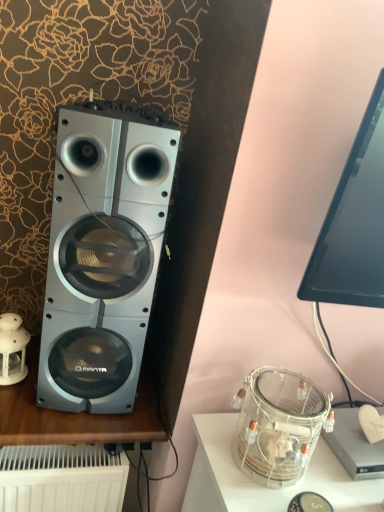
Question: Could you tell me if clear glass jar at lower right is turned towards white porcelain lantern at left?

Choices:
 (A) no
 (B) yes

Answer: (A)

Question: From a real-world perspective, is clear glass jar at lower right physically below white porcelain lantern at left?

Choices:
 (A) yes
 (B) no

Answer: (A)

Question: Can you confirm if clear glass jar at lower right is taller than white porcelain lantern at left?

Choices:
 (A) yes
 (B) no

Answer: (A)

Question: Is clear glass jar at lower right to the left of white porcelain lantern at left from the viewer's perspective?

Choices:
 (A) yes
 (B) no

Answer: (B)

Question: From the image's perspective, is clear glass jar at lower right below white porcelain lantern at left?

Choices:
 (A) no
 (B) yes

Answer: (B)

Question: Is clear glass jar at lower right smaller than white porcelain lantern at left?

Choices:
 (A) yes
 (B) no

Answer: (B)

Question: From the image's perspective, is clear glass jar at lower right below silver metallic speaker at left?

Choices:
 (A) yes
 (B) no

Answer: (A)

Question: Is the depth of clear glass jar at lower right greater than that of silver metallic speaker at left?

Choices:
 (A) yes
 (B) no

Answer: (B)

Question: Can you confirm if clear glass jar at lower right is positioned to the right of silver metallic speaker at left?

Choices:
 (A) no
 (B) yes

Answer: (B)

Question: Considering the relative positions of clear glass jar at lower right and silver metallic speaker at left in the image provided, is clear glass jar at lower right in front of silver metallic speaker at left?

Choices:
 (A) no
 (B) yes

Answer: (B)

Question: Is clear glass jar at lower right not close to silver metallic speaker at left?

Choices:
 (A) yes
 (B) no

Answer: (B)

Question: Can you confirm if clear glass jar at lower right is wider than silver metallic speaker at left?

Choices:
 (A) yes
 (B) no

Answer: (B)

Question: Considering the relative positions of silver metallic speaker at left and black glossy monitor at upper right in the image provided, is silver metallic speaker at left to the right of black glossy monitor at upper right from the viewer's perspective?

Choices:
 (A) no
 (B) yes

Answer: (A)